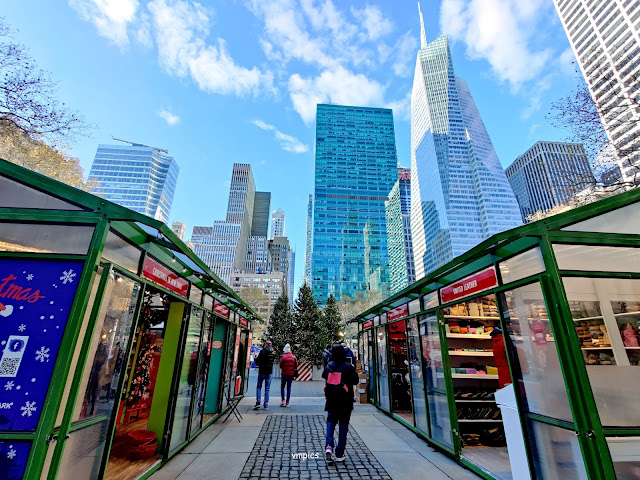
Identify the location of boxes. (365, 393).